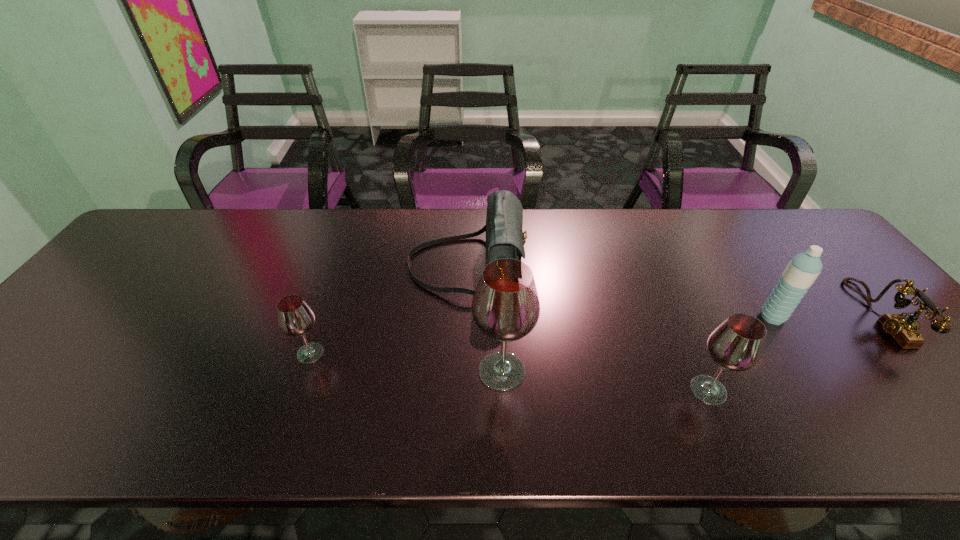
Locate an element on the screen. This screenshot has width=960, height=540. vacant space located on the right of the leftmost wineglass is located at coordinates (352, 353).

Locate an element on the screen. This screenshot has height=540, width=960. vacant space situated 0.380m on the right of the tallest object is located at coordinates (699, 371).

At what (x,y) coordinates should I click in order to perform the action: click on free space located 0.210m on the back of the second shortest wineglass. Please return your answer as a coordinate pair (x, y). Looking at the image, I should click on (671, 305).

Image resolution: width=960 pixels, height=540 pixels. In order to click on free location located on the back of the water bottle in this screenshot , I will do `click(740, 267)`.

Find the location of a particular element. This screenshot has width=960, height=540. vacant space located on the right of the shoulder bag is located at coordinates (577, 265).

This screenshot has width=960, height=540. I want to click on vacant space located 0.340m on the front-facing side of the shortest object, so click(x=733, y=315).

The image size is (960, 540). What are the coordinates of `free space located on the front-facing side of the shortest object` in the screenshot? It's located at (797, 315).

You are a GUI agent. You are given a task and a screenshot of the screen. Output one action in this format:
    pyautogui.click(x=<x>, y=<y>)
    Task: Click on the free region located on the front-facing side of the shortest object
    Image resolution: width=960 pixels, height=540 pixels.
    Given the screenshot: What is the action you would take?
    pyautogui.click(x=754, y=315)

Locate an element on the screen. object that is positioned at the far edge is located at coordinates (505, 238).

This screenshot has height=540, width=960. I want to click on object that is positioned at the right edge, so click(904, 330).